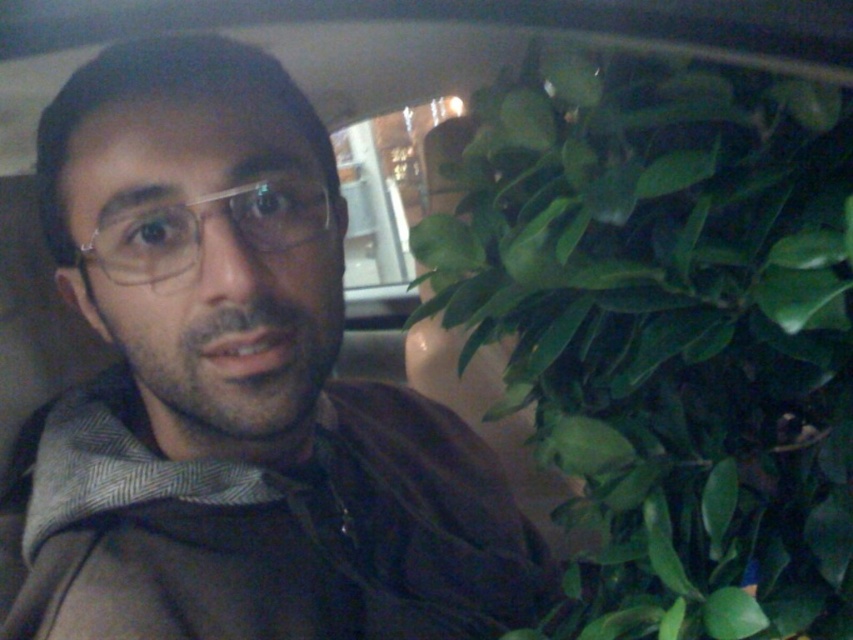
Question: Is green matte leafy plant at right further to the viewer compared to clear plastic glasses at center?

Choices:
 (A) yes
 (B) no

Answer: (B)

Question: Is brown fabric at center below green matte leafy plant at right?

Choices:
 (A) yes
 (B) no

Answer: (A)

Question: Does green matte leafy plant at right lie behind clear plastic glasses at center?

Choices:
 (A) no
 (B) yes

Answer: (A)

Question: Which point appears farthest from the camera in this image?

Choices:
 (A) (148, 444)
 (B) (672, 337)

Answer: (A)

Question: Which object is the farthest from the green matte leafy plant at right?

Choices:
 (A) clear plastic glasses at center
 (B) brown fabric at center

Answer: (A)

Question: Which point is closer to the camera?

Choices:
 (A) clear plastic glasses at center
 (B) green matte leafy plant at right

Answer: (B)